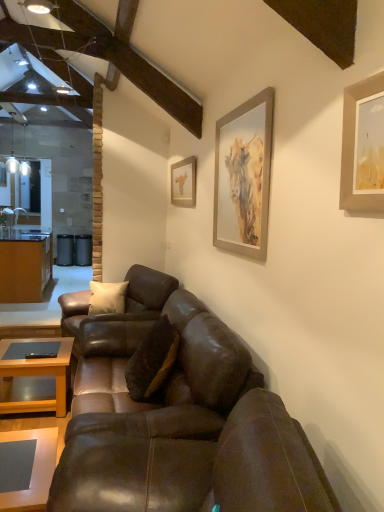
This screenshot has width=384, height=512. What do you see at coordinates (34, 469) in the screenshot? I see `matte gray coffee table at lower left, the 1th coffee table in the right-to-left sequence` at bounding box center [34, 469].

From the picture: Measure the distance between brown leather couch at lower center, which ranks as the 3th studio couch in back-to-front order, and camera.

brown leather couch at lower center, which ranks as the 3th studio couch in back-to-front order, and camera are 1.04 meters apart from each other.

Measure the distance between point (x=193, y=394) and camera.

Point (x=193, y=394) is 2.30 meters from camera.

Where is `matte gray coffee table at lower left, the 1th coffee table in the right-to-left sequence`? matte gray coffee table at lower left, the 1th coffee table in the right-to-left sequence is located at coordinates (34, 469).

There is a silver metallic picture frame at upper right, which ranks as the first picture frame in right-to-left order. In order to click on the 2nd studio couch below it (from the image's perspective) in this screenshot , I will do `click(206, 359)`.

From a real-world perspective, between silver metallic picture frame at upper right, the 2th picture frame in the left-to-right sequence, and brown leather couch at center, acting as the 2th studio couch starting from the back, who is vertically lower?

brown leather couch at center, acting as the 2th studio couch starting from the back.

Would you consider silver metallic picture frame at upper right, which ranks as the first picture frame in right-to-left order, to be distant from brown leather couch at center, acting as the second studio couch starting from the front?

No, silver metallic picture frame at upper right, which ranks as the first picture frame in right-to-left order, is not far from brown leather couch at center, acting as the second studio couch starting from the front.

Is silver metallic picture frame at upper right, which ranks as the first picture frame in right-to-left order, taller or shorter than brown leather couch at center, acting as the 2th studio couch starting from the back?

In the image, silver metallic picture frame at upper right, which ranks as the first picture frame in right-to-left order, appears to be shorter than brown leather couch at center, acting as the 2th studio couch starting from the back.

Can you tell me how much matte gray coffee table at lower left, the 2th coffee table from the back, and silver metallic picture frame at upper right, the 1th picture frame when ordered from front to back, differ in facing direction?

The facing directions of matte gray coffee table at lower left, the 2th coffee table from the back, and silver metallic picture frame at upper right, the 1th picture frame when ordered from front to back, are 1.3 degrees apart.

Is matte gray coffee table at lower left, the 2th coffee table from the back, positioned with its back to silver metallic picture frame at upper right, the 2th picture frame in the left-to-right sequence?

matte gray coffee table at lower left, the 2th coffee table from the back, is not turned away from silver metallic picture frame at upper right, the 2th picture frame in the left-to-right sequence.

Considering the points (46, 477) and (222, 212), which point is in front, point (46, 477) or point (222, 212)?

The point (46, 477) is more forward.

Considering the positions of objects matte gray coffee table at lower left, the 1th coffee table in the right-to-left sequence, and silver metallic picture frame at upper right, which is counted as the 2th picture frame, starting from the back, in the image provided, who is more to the right, matte gray coffee table at lower left, the 1th coffee table in the right-to-left sequence, or silver metallic picture frame at upper right, which is counted as the 2th picture frame, starting from the back,?

silver metallic picture frame at upper right, which is counted as the 2th picture frame, starting from the back.

Which object is closer to the camera, matte wooden coffee table at lower left, which is the second coffee table in right-to-left order, or matte gray coffee table at lower left, the 1th coffee table positioned from the front?

matte gray coffee table at lower left, the 1th coffee table positioned from the front, is more forward.

In the scene shown: Which is more to the right, matte wooden coffee table at lower left, the 2th coffee table positioned from the front, or matte gray coffee table at lower left, the 2th coffee table from the back?

matte gray coffee table at lower left, the 2th coffee table from the back, is more to the right.

From the image's perspective, is matte wooden coffee table at lower left, arranged as the first coffee table when viewed from the left, over matte gray coffee table at lower left, the 2th coffee table when ordered from left to right?

Correct, matte wooden coffee table at lower left, arranged as the first coffee table when viewed from the left, appears higher than matte gray coffee table at lower left, the 2th coffee table when ordered from left to right, in the image.

Considering the relative sizes of matte wooden coffee table at lower left, the 2th coffee table positioned from the front, and matte gray coffee table at lower left, the 1th coffee table in the right-to-left sequence, in the image provided, is matte wooden coffee table at lower left, the 2th coffee table positioned from the front, bigger than matte gray coffee table at lower left, the 1th coffee table in the right-to-left sequence,?

Yes, matte wooden coffee table at lower left, the 2th coffee table positioned from the front, is bigger than matte gray coffee table at lower left, the 1th coffee table in the right-to-left sequence.

From a real-world perspective, which is physically above, brown wood cabinetry at left or matte gray coffee table at lower left, the 2th coffee table when ordered from left to right?

brown wood cabinetry at left.

From the image's perspective, which object appears higher, brown wood cabinetry at left or matte gray coffee table at lower left, the 1th coffee table positioned from the front?

brown wood cabinetry at left, from the image's perspective.

Between brown wood cabinetry at left and matte gray coffee table at lower left, the 1th coffee table positioned from the front, which one has smaller width?

Thinner between the two is matte gray coffee table at lower left, the 1th coffee table positioned from the front.

Is matte gray coffee table at lower left, the 2th coffee table from the back, far away from brown wood cabinetry at left?

matte gray coffee table at lower left, the 2th coffee table from the back, is far away from brown wood cabinetry at left.

From the image's perspective, is matte gray coffee table at lower left, the 1th coffee table positioned from the front, located above brown wood cabinetry at left?

No.

Which of these two, matte gray coffee table at lower left, the 2th coffee table from the back, or brown wood cabinetry at left, is thinner?

matte gray coffee table at lower left, the 2th coffee table from the back.

From a real-world perspective, is matte gray coffee table at lower left, the 1th coffee table positioned from the front, below brown wood cabinetry at left?

Yes, from a real-world perspective, matte gray coffee table at lower left, the 1th coffee table positioned from the front, is beneath brown wood cabinetry at left.

From the image's perspective, starting from the matte gray coffee table at lower left, the 2th coffee table when ordered from left to right, which studio couch is the 3rd one above? Please provide its 2D coordinates.

[(118, 315)]

Does brown leather couch at center, positioned as the 3th studio couch in front-to-back order, come behind matte gray coffee table at lower left, the 1th coffee table in the right-to-left sequence?

Yes, brown leather couch at center, positioned as the 3th studio couch in front-to-back order, is further from the viewer.

From the image's perspective, relative to matte gray coffee table at lower left, the 1th coffee table positioned from the front, is brown leather couch at center, positioned as the 3th studio couch in front-to-back order, above or below?

brown leather couch at center, positioned as the 3th studio couch in front-to-back order, is situated higher than matte gray coffee table at lower left, the 1th coffee table positioned from the front, in the image.

Does brown leather couch at center, positioned as the 3th studio couch in front-to-back order, have a lesser width compared to matte gray coffee table at lower left, the 1th coffee table in the right-to-left sequence?

Incorrect, the width of brown leather couch at center, positioned as the 3th studio couch in front-to-back order, is not less than that of matte gray coffee table at lower left, the 1th coffee table in the right-to-left sequence.

In terms of height, does matte wooden coffee table at lower left, the 1th coffee table when ordered from back to front, look taller or shorter compared to matte gold picture frame at upper center, arranged as the first picture frame when viewed from the back?

Considering their sizes, matte wooden coffee table at lower left, the 1th coffee table when ordered from back to front, has more height than matte gold picture frame at upper center, arranged as the first picture frame when viewed from the back.

Based on the photo, how far apart are matte wooden coffee table at lower left, which is the second coffee table in right-to-left order, and matte gold picture frame at upper center, acting as the second picture frame starting from the right?

matte wooden coffee table at lower left, which is the second coffee table in right-to-left order, is 1.95 meters away from matte gold picture frame at upper center, acting as the second picture frame starting from the right.

Does matte wooden coffee table at lower left, arranged as the first coffee table when viewed from the left, have a smaller size compared to matte gold picture frame at upper center, the second picture frame when ordered from front to back?

No, matte wooden coffee table at lower left, arranged as the first coffee table when viewed from the left, is not smaller than matte gold picture frame at upper center, the second picture frame when ordered from front to back.

From the picture: Is matte wooden coffee table at lower left, arranged as the first coffee table when viewed from the left, in contact with matte gold picture frame at upper center, arranged as the first picture frame when viewed from the back?

There is a gap between matte wooden coffee table at lower left, arranged as the first coffee table when viewed from the left, and matte gold picture frame at upper center, arranged as the first picture frame when viewed from the back.

I want to click on the 2nd studio couch counting from the left side of the silver metallic picture frame at upper right, which ranks as the first picture frame in right-to-left order, so click(206, 359).

Where is `coffee table in front of the silver metallic picture frame at upper right, the 1th picture frame when ordered from front to back`? Image resolution: width=384 pixels, height=512 pixels. coffee table in front of the silver metallic picture frame at upper right, the 1th picture frame when ordered from front to back is located at coordinates (34, 469).

Looking at the image, which one is located closer to matte wooden coffee table at lower left, arranged as the first coffee table when viewed from the left, brown suede pillow at center or matte gray coffee table at lower left, the 2th coffee table when ordered from left to right?

brown suede pillow at center lies closer to matte wooden coffee table at lower left, arranged as the first coffee table when viewed from the left, than the other object.

Consider the image. Considering their positions, is silver metallic picture frame at upper right, which is counted as the 2th picture frame, starting from the back, positioned further to brown leather couch at center, acting as the 2th studio couch starting from the back, than brown leather couch at center, which is the 1th studio couch from back to front?

silver metallic picture frame at upper right, which is counted as the 2th picture frame, starting from the back, lies further to brown leather couch at center, acting as the 2th studio couch starting from the back, than the other object.

Considering their positions, is matte gold picture frame at upper center, positioned as the 1th picture frame in left-to-right order, positioned further to silver metallic picture frame at upper right, which is counted as the 2th picture frame, starting from the back, than brown leather couch at center, acting as the 2th studio couch starting from the back?

matte gold picture frame at upper center, positioned as the 1th picture frame in left-to-right order.

When comparing their distances from brown leather couch at center, positioned as the 3th studio couch in front-to-back order, does brown suede pillow at center or silver metallic picture frame at upper right, which ranks as the first picture frame in right-to-left order, seem further?

The object further to brown leather couch at center, positioned as the 3th studio couch in front-to-back order, is silver metallic picture frame at upper right, which ranks as the first picture frame in right-to-left order.

Estimate the real-world distances between objects in this image. Which object is further from brown leather couch at center, positioned as the 3th studio couch in front-to-back order, matte wooden coffee table at lower left, the 2th coffee table positioned from the front, or matte gray coffee table at lower left, the 1th coffee table positioned from the front?

matte gray coffee table at lower left, the 1th coffee table positioned from the front.

Which object lies nearer to the anchor point brown leather couch at center, positioned as the 3th studio couch in front-to-back order, brown leather couch at center, acting as the 2th studio couch starting from the back, or matte gray coffee table at lower left, the 1th coffee table in the right-to-left sequence?

brown leather couch at center, acting as the 2th studio couch starting from the back, lies closer to brown leather couch at center, positioned as the 3th studio couch in front-to-back order, than the other object.

When comparing their distances from brown wood cabinetry at left, does brown leather couch at center, acting as the 2th studio couch starting from the back, or matte gold picture frame at upper center, arranged as the first picture frame when viewed from the back, seem closer?

A: matte gold picture frame at upper center, arranged as the first picture frame when viewed from the back.

Considering their positions, is brown suede pillow at center positioned further to matte gold picture frame at upper center, the second picture frame when ordered from front to back, than brown leather couch at center, acting as the 2th studio couch starting from the back?

The object further to matte gold picture frame at upper center, the second picture frame when ordered from front to back, is brown suede pillow at center.

Image resolution: width=384 pixels, height=512 pixels. Find the location of `studio couch between silver metallic picture frame at upper right, the 2th picture frame in the left-to-right sequence, and brown wood cabinetry at left, along the z-axis`. studio couch between silver metallic picture frame at upper right, the 2th picture frame in the left-to-right sequence, and brown wood cabinetry at left, along the z-axis is located at coordinates (118, 315).

The height and width of the screenshot is (512, 384). Find the location of `pillow between matte wooden coffee table at lower left, the 2th coffee table positioned from the front, and silver metallic picture frame at upper right, the 2th picture frame in the left-to-right sequence, from left to right`. pillow between matte wooden coffee table at lower left, the 2th coffee table positioned from the front, and silver metallic picture frame at upper right, the 2th picture frame in the left-to-right sequence, from left to right is located at coordinates (152, 360).

Where is `pillow between silver metallic picture frame at upper right, the 2th picture frame in the left-to-right sequence, and matte gold picture frame at upper center, positioned as the 1th picture frame in left-to-right order, in the front-back direction`? pillow between silver metallic picture frame at upper right, the 2th picture frame in the left-to-right sequence, and matte gold picture frame at upper center, positioned as the 1th picture frame in left-to-right order, in the front-back direction is located at coordinates (152, 360).

Locate an element on the screen. This screenshot has width=384, height=512. picture frame positioned between brown leather couch at lower center, placed as the first studio couch when sorted from front to back, and brown leather couch at center, which is the 1th studio couch from back to front, from near to far is located at coordinates click(244, 177).